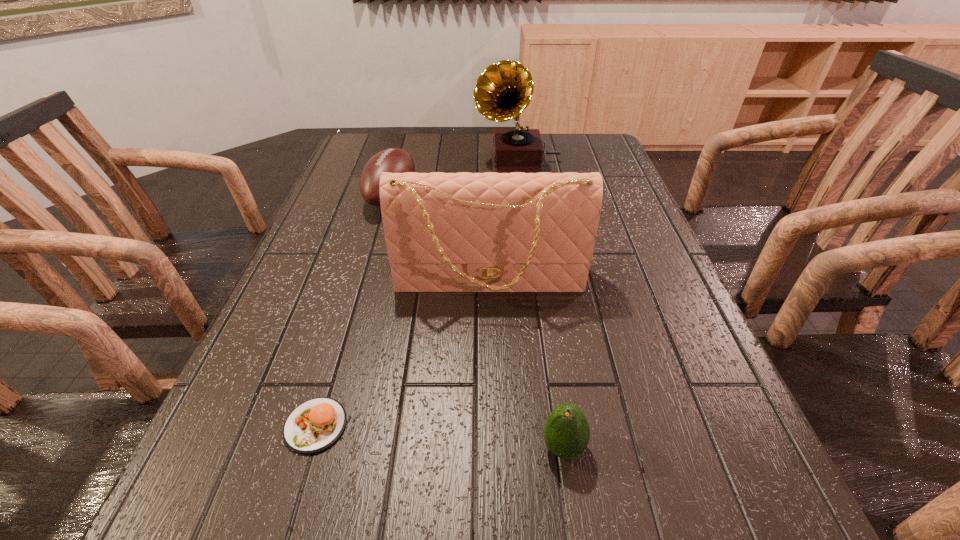
At what (x,y) coordinates should I click in order to perform the action: click on the farthest object. Please return your answer as a coordinate pair (x, y). Looking at the image, I should click on (504, 90).

Where is `the third nearest object`? The image size is (960, 540). the third nearest object is located at coordinates (445, 232).

Locate an element on the screen. The height and width of the screenshot is (540, 960). the second farthest object is located at coordinates (394, 160).

The height and width of the screenshot is (540, 960). Find the location of `the third shortest object`. the third shortest object is located at coordinates click(394, 160).

The height and width of the screenshot is (540, 960). I want to click on avocado, so click(566, 432).

Find the location of a particular element. patty is located at coordinates (313, 426).

Identify the location of vacant space situated 0.320m from the horn of the phonograph record. (373, 161).

At what (x,y) coordinates should I click in order to perform the action: click on vacant space located from the horn of the phonograph record. Please return your answer as a coordinate pair (x, y). Looking at the image, I should click on (383, 161).

Locate an element on the screen. This screenshot has width=960, height=540. free location located from the horn of the phonograph record is located at coordinates (427, 161).

In order to click on free spot located 0.350m on the front-facing side of the handbag in this screenshot , I will do `click(493, 471)`.